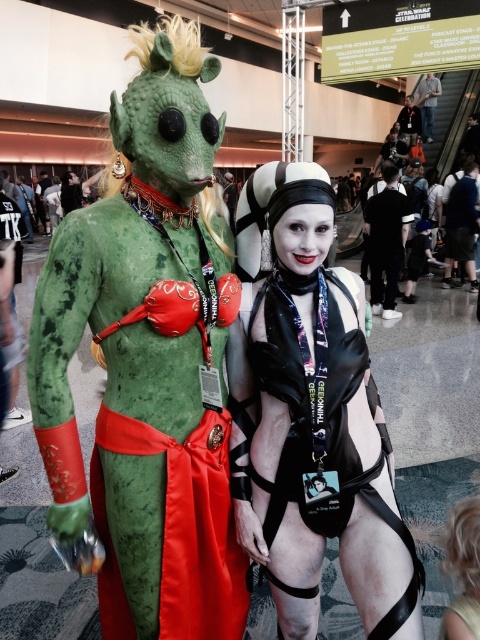
You are a photographer at the convention and need to decide which costume allows for more comfortable movement between the satin black bodysuit at center and the denim jacket at center. Based on their physical characteristics, which one would you recommend?

The satin black bodysuit at center is thinner than the denim jacket at center, so it would allow for more comfortable movement due to its flexibility and less bulk.

You are a photographer at the convention and need to capture both the green matte skin zombie at center and the satin black bodysuit at center in a single frame. Based on their sizes, which costume will appear larger in the photo?

The green matte skin zombie at center will appear larger in the photo because its width is greater than that of the satin black bodysuit at center.

You are at a costume convention and need to decide which costume to try on next. You see the green matte skin zombie at center and the denim jacket at center. Which costume has a wider appearance?

The denim jacket at center is wider than the green matte skin zombie at center.